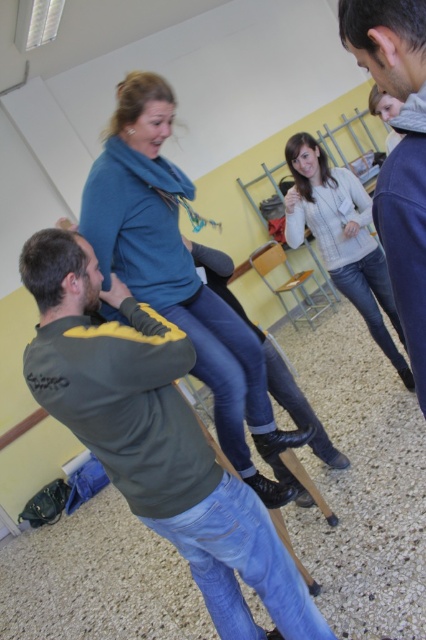
Question: Is dark green sweatshirt at center behind wooden chair at center?

Choices:
 (A) no
 (B) yes

Answer: (A)

Question: Is dark green sweatshirt at center to the right of wooden chair at center from the viewer's perspective?

Choices:
 (A) no
 (B) yes

Answer: (A)

Question: Can you confirm if dark green sweatshirt at center is positioned to the left of light gray knitted sweater at center?

Choices:
 (A) no
 (B) yes

Answer: (B)

Question: Which object is positioned farthest from the blue soft scarf at upper center?

Choices:
 (A) dark green sweatshirt at center
 (B) wooden chair at center

Answer: (B)

Question: Which point is farther from the camera taking this photo?

Choices:
 (A) (62, 260)
 (B) (291, 291)

Answer: (B)

Question: Which point appears closest to the camera in this image?

Choices:
 (A) (374, 326)
 (B) (109, 180)

Answer: (B)